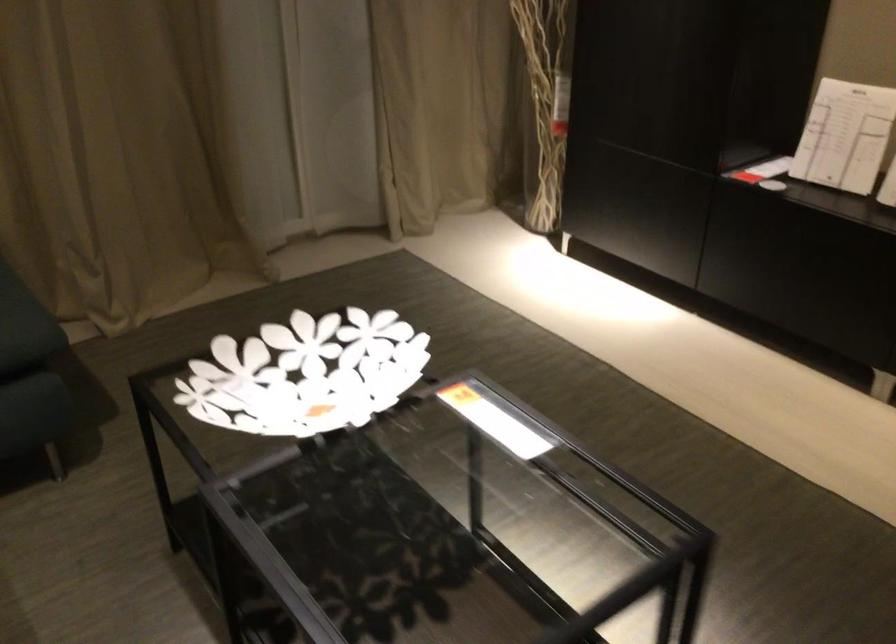
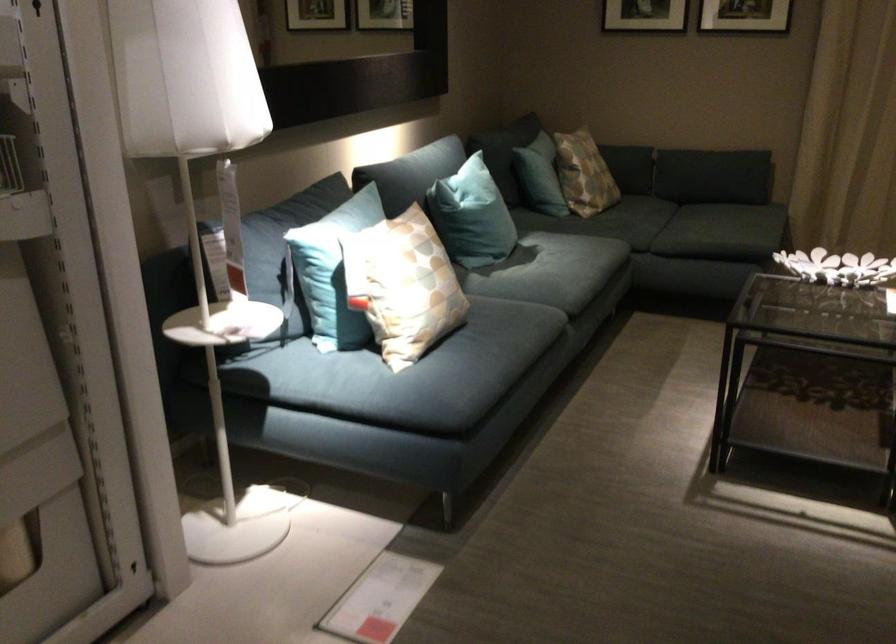
Where in the second image is the point corresponding to pixel 282 393 from the first image?

(837, 267)